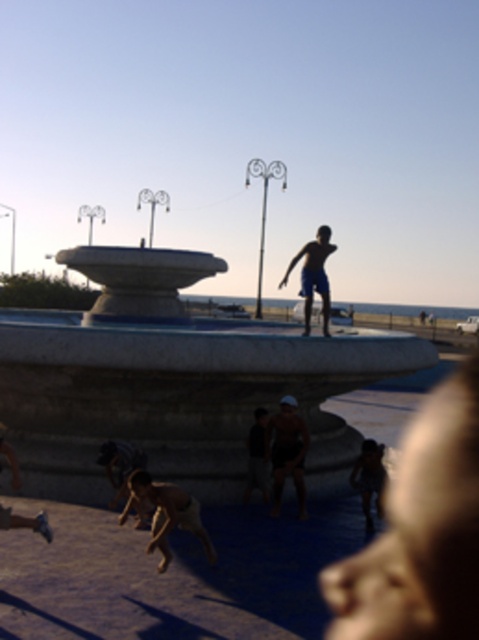
Question: Which point is closer to the camera?

Choices:
 (A) (299, 435)
 (B) (231, 490)

Answer: (B)

Question: Can you confirm if white marble fountain at center is wider than dark brown leather shorts at center?

Choices:
 (A) yes
 (B) no

Answer: (A)

Question: Is dark brown leather shorts at center to the right of blue matte shorts at center from the viewer's perspective?

Choices:
 (A) no
 (B) yes

Answer: (A)

Question: Among these objects, which one is nearest to the camera?

Choices:
 (A) blue matte shorts at center
 (B) white marble fountain at center
 (C) dark brown leather shorts at center

Answer: (B)

Question: Considering the real-world distances, which object is closest to the white marble fountain at center?

Choices:
 (A) dark brown leather shorts at center
 (B) blue matte shorts at center

Answer: (A)

Question: Can you confirm if white marble fountain at center is wider than dark brown leather shorts at center?

Choices:
 (A) no
 (B) yes

Answer: (B)